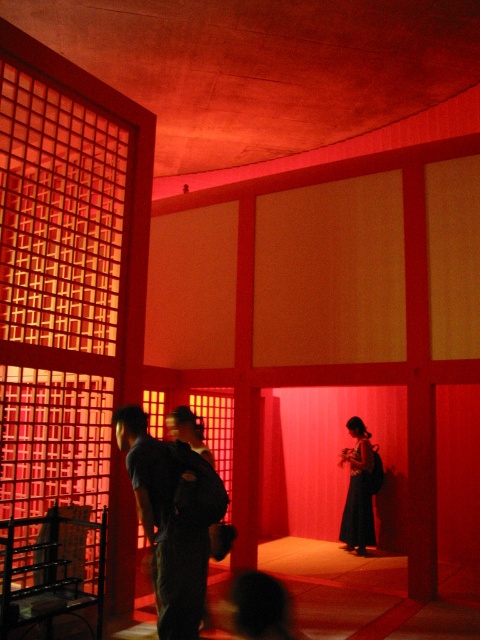
Question: Does translucent bamboo curtain at left have a greater width compared to dark blue fabric backpack at center?

Choices:
 (A) no
 (B) yes

Answer: (B)

Question: Which point is farther from the camera taking this photo?

Choices:
 (A) (71, 291)
 (B) (187, 573)

Answer: (A)

Question: Does dark blue fabric backpack at center have a larger size compared to black silk dress at center?

Choices:
 (A) yes
 (B) no

Answer: (A)

Question: Can you confirm if dark blue fabric backpack at center is positioned to the left of black silk dress at center?

Choices:
 (A) yes
 (B) no

Answer: (A)

Question: Which point is farther to the camera?

Choices:
 (A) click(25, 406)
 (B) click(200, 500)

Answer: (A)

Question: Which object is farther from the camera taking this photo?

Choices:
 (A) dark blue fabric backpack at center
 (B) translucent bamboo curtain at left
 (C) black silk dress at center

Answer: (C)